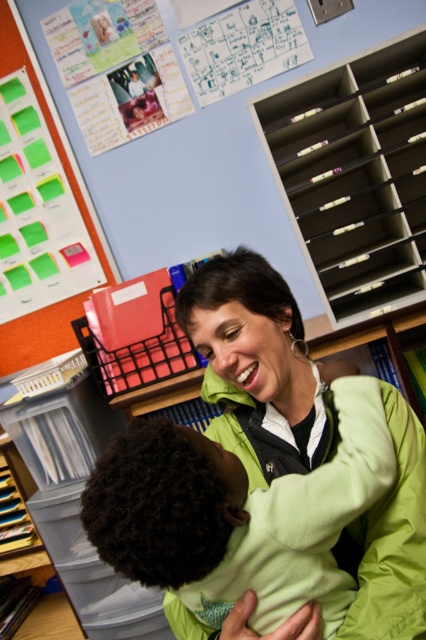
Question: Considering the real-world distances, which object is closest to the gray plastic bookshelf at upper right?

Choices:
 (A) green sticky notes at upper left
 (B) green fleece jacket at center

Answer: (B)

Question: Is green fleece jacket at center above gray plastic bookshelf at upper right?

Choices:
 (A) yes
 (B) no

Answer: (B)

Question: Among these objects, which one is farthest from the camera?

Choices:
 (A) green sticky notes at upper left
 (B) green fleece jacket at center

Answer: (A)

Question: Is green fleece jacket at center thinner than green sticky notes at upper left?

Choices:
 (A) yes
 (B) no

Answer: (A)

Question: Is green fleece jacket at center thinner than gray plastic bookshelf at upper right?

Choices:
 (A) yes
 (B) no

Answer: (A)

Question: Among these points, which one is nearest to the camera?

Choices:
 (A) (287, 428)
 (B) (54, 312)

Answer: (A)